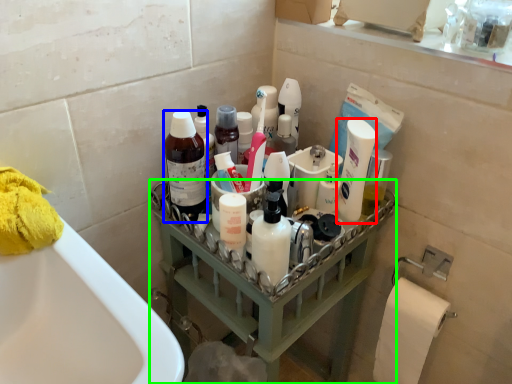
Question: Based on their relative distances, which object is farther from mouthwash (highlighted by a red box)? Choose from cleaning product (highlighted by a blue box) and balustrade (highlighted by a green box).

Choices:
 (A) cleaning product
 (B) balustrade

Answer: (A)